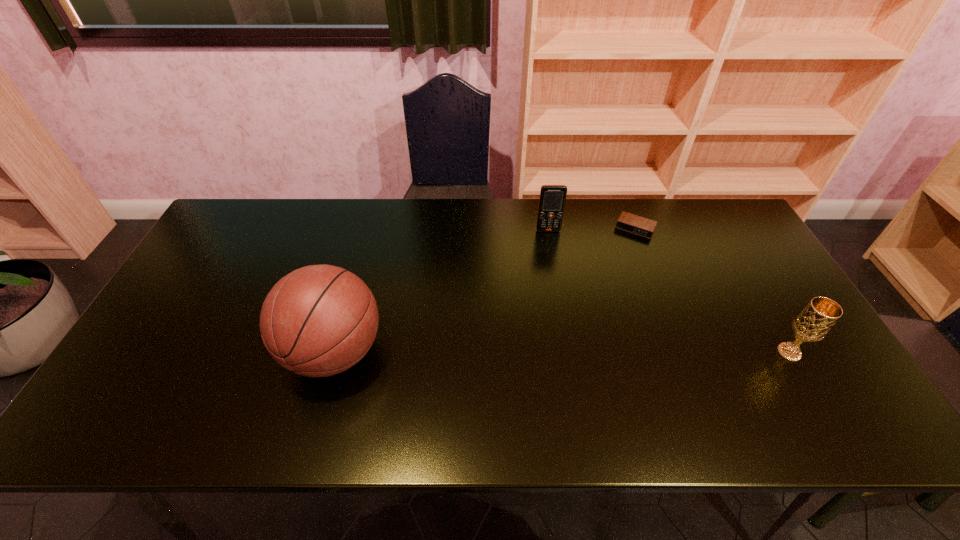
The image size is (960, 540). What are the coordinates of `basketball` in the screenshot? It's located at (319, 320).

You are a GUI agent. You are given a task and a screenshot of the screen. Output one action in this format:
    pyautogui.click(x=<x>, y=<y>)
    Task: Click on the tallest object
    The height and width of the screenshot is (540, 960).
    Given the screenshot: What is the action you would take?
    pyautogui.click(x=319, y=320)

At what (x,y) coordinates should I click in order to perform the action: click on chalice. Please return your answer as a coordinate pair (x, y). The image size is (960, 540). Looking at the image, I should click on (813, 323).

Identify the location of cellular telephone. The image size is (960, 540). (552, 200).

This screenshot has height=540, width=960. Find the location of `the shortest object`. the shortest object is located at coordinates (628, 222).

Locate an element on the screen. the third object from left to right is located at coordinates (628, 222).

Find the location of a particular element. free region located on the back of the basketball is located at coordinates (352, 288).

The image size is (960, 540). In order to click on vacant position located on the back of the chalice in this screenshot , I will do `click(741, 270)`.

Image resolution: width=960 pixels, height=540 pixels. Find the location of `vacant space positioned on the screen of the cellular telephone`. vacant space positioned on the screen of the cellular telephone is located at coordinates (559, 302).

This screenshot has height=540, width=960. In order to click on vacant space located 0.270m on the screen of the cellular telephone in this screenshot , I will do `click(558, 295)`.